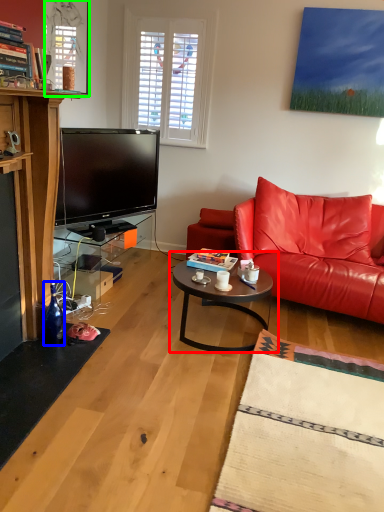
Question: Which object is the farthest from coffee table (highlighted by a red box)? Choose among these: bottle (highlighted by a blue box) or window screen (highlighted by a green box).

Choices:
 (A) bottle
 (B) window screen

Answer: (B)